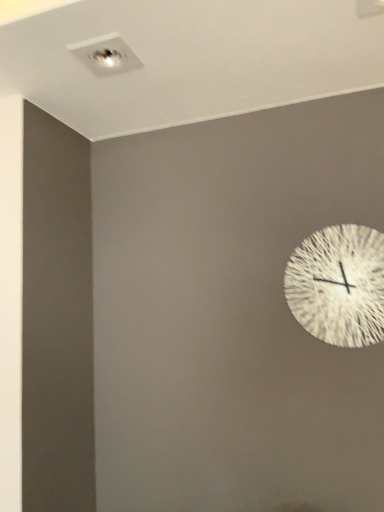
You are a GUI agent. You are given a task and a screenshot of the screen. Output one action in this format:
    pyautogui.click(x=<x>, y=<y>)
    Task: Click on the white textured clock at right
    
    Given the screenshot: What is the action you would take?
    pyautogui.click(x=339, y=285)

What do you see at coordinates (339, 285) in the screenshot? I see `white textured clock at right` at bounding box center [339, 285].

Locate an element on the screen. The image size is (384, 512). white textured clock at right is located at coordinates 339,285.